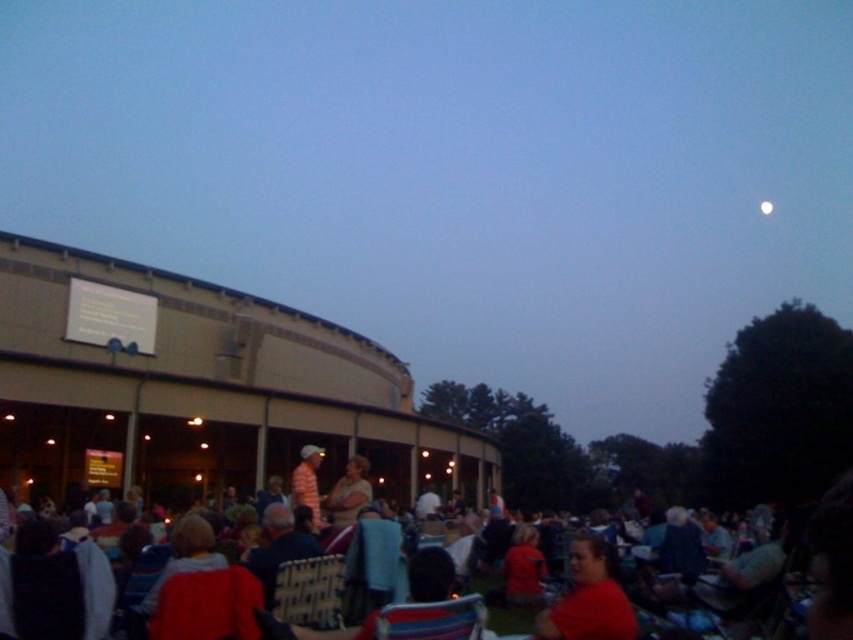
Question: Does striped cotton shirt at center appear on the right side of white glossy moon at upper right?

Choices:
 (A) no
 (B) yes

Answer: (A)

Question: Which object is closer to the camera taking this photo?

Choices:
 (A) matte beige sweater at center
 (B) striped cotton shirt at center
 (C) white glossy moon at upper right
 (D) matte red shirt at center

Answer: (D)

Question: Which object is the farthest from the white glossy moon at upper right?

Choices:
 (A) matte beige sweater at center
 (B) matte red shirt at center
 (C) striped cotton shirt at center

Answer: (B)

Question: Does matte red shirt at center have a smaller size compared to white glossy moon at upper right?

Choices:
 (A) no
 (B) yes

Answer: (A)

Question: In this image, where is matte red shirt at center located relative to matte beige sweater at center?

Choices:
 (A) left
 (B) right

Answer: (B)

Question: Which point is closer to the camera?

Choices:
 (A) matte beige sweater at center
 (B) striped cotton shirt at center
 (C) white glossy moon at upper right
 (D) matte red shirt at center

Answer: (D)